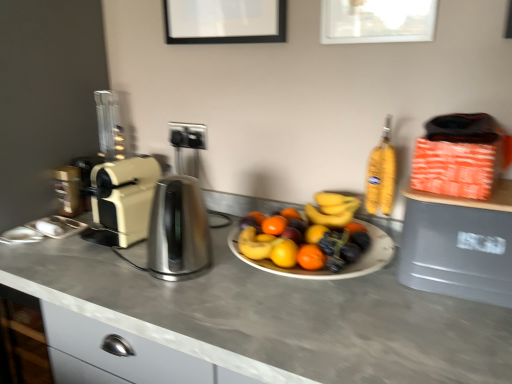
Question: From the image's perspective, is beige plastic toaster at left above or below metallic silver coffee machine at left?

Choices:
 (A) below
 (B) above

Answer: (A)

Question: Is point (121, 244) positioned closer to the camera than point (71, 185)?

Choices:
 (A) closer
 (B) farther

Answer: (A)

Question: Considering the real-world distances, which object is closest to the beige plastic toaster at left?

Choices:
 (A) gray plastic trash can at right
 (B) metallic silver coffee machine at left
 (C) satin silver kettle at center
 (D) smooth gray countertop at center

Answer: (C)

Question: Which of these objects is positioned closest to the gray plastic trash can at right?

Choices:
 (A) satin silver kettle at center
 (B) metallic silver coffee machine at left
 (C) beige plastic toaster at left
 (D) smooth gray countertop at center

Answer: (D)